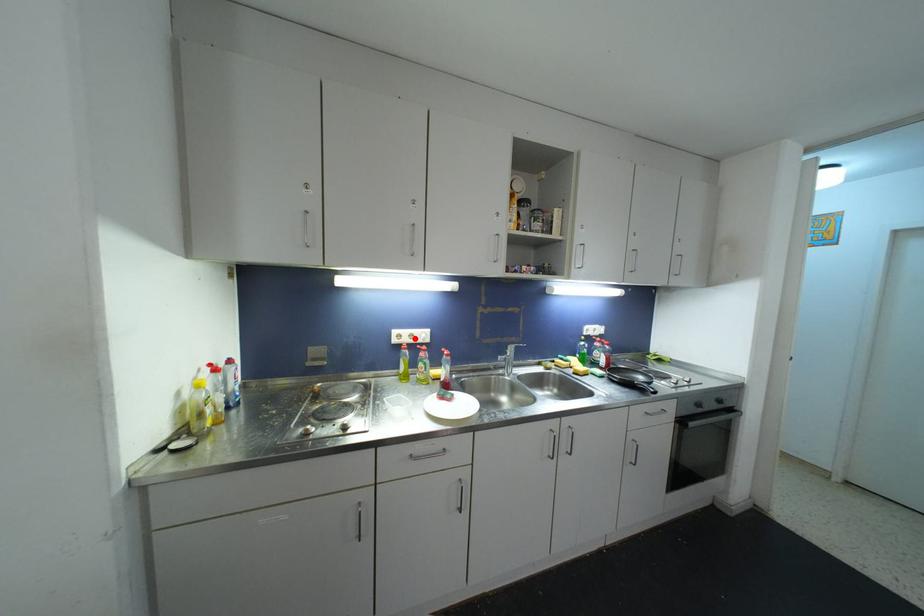
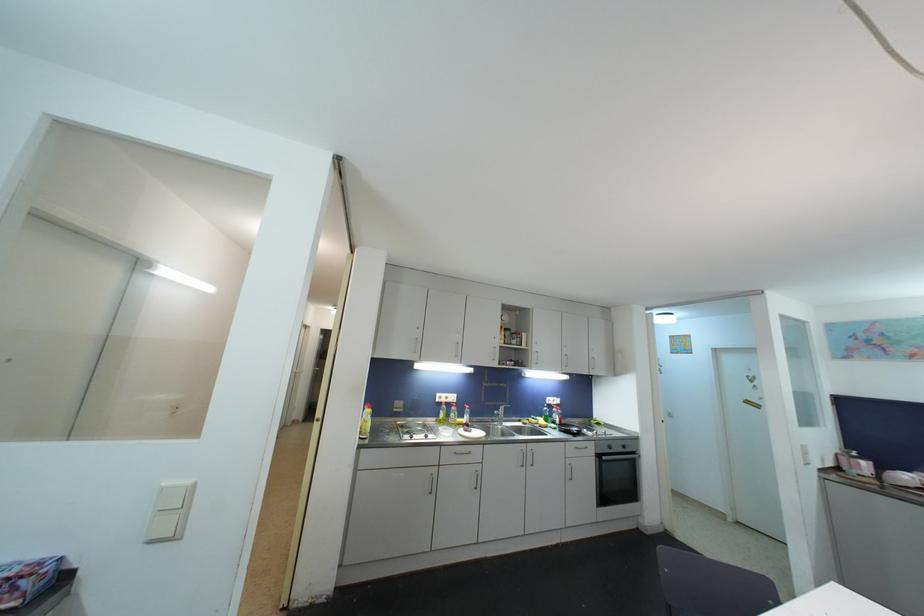
Question: A red point is marked in image1. In image2, is the corresponding 3D point closer to the camera or farther? Reply with the corresponding letter.

Choices:
 (A) The corresponding 3D point is closer.
 (B) The corresponding 3D point is farther.

Answer: (B)